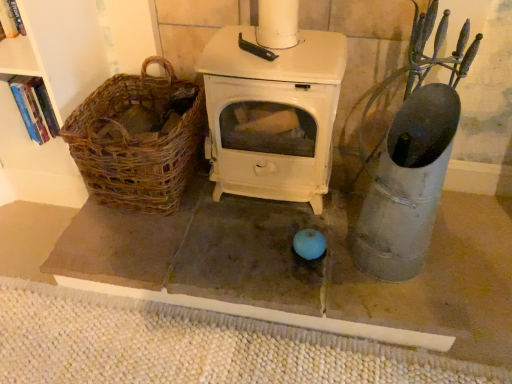
You are a GUI agent. You are given a task and a screenshot of the screen. Output one action in this format:
    pyautogui.click(x=<x>, y=<y>)
    Task: Click on the blank space situated above woven beige mat at lower center (from a real-world perspective)
    The width and height of the screenshot is (512, 384).
    Given the screenshot: What is the action you would take?
    click(145, 345)